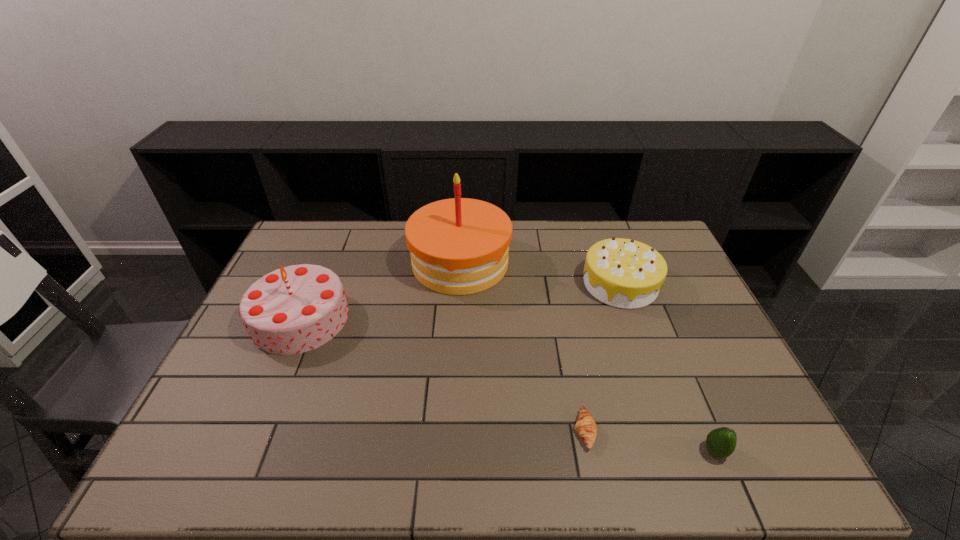
Identify the location of the tallest birthday cake. (459, 246).

The width and height of the screenshot is (960, 540). What are the coordinates of `the second object from left to right` in the screenshot? It's located at (459, 246).

Identify the location of the fourth shortest object. The width and height of the screenshot is (960, 540). (295, 309).

The width and height of the screenshot is (960, 540). I want to click on the second tallest birthday cake, so click(x=295, y=309).

Find the location of a particular element. the rightmost birthday cake is located at coordinates (623, 273).

The width and height of the screenshot is (960, 540). I want to click on the shortest birthday cake, so click(623, 273).

Find the location of a particular element. This screenshot has width=960, height=540. the second shortest object is located at coordinates (721, 442).

Where is `pastry`? This screenshot has width=960, height=540. pastry is located at coordinates (585, 425).

Locate an element on the screen. the shortest object is located at coordinates [585, 425].

Where is `vacant position located 0.170m on the front of the second birthday cake from right to left`? The image size is (960, 540). vacant position located 0.170m on the front of the second birthday cake from right to left is located at coordinates [456, 339].